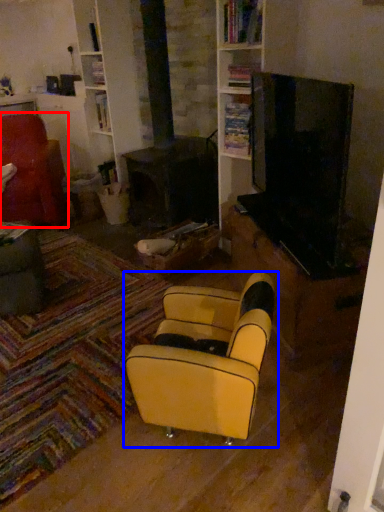
Question: Which of the following is the farthest to the observer, chair (highlighted by a red box) or chair (highlighted by a blue box)?

Choices:
 (A) chair
 (B) chair

Answer: (A)